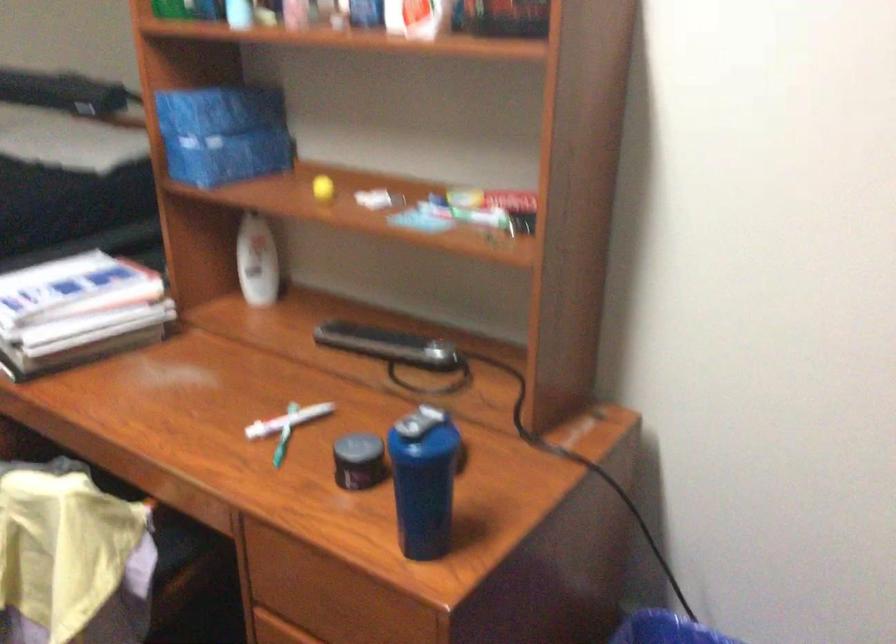
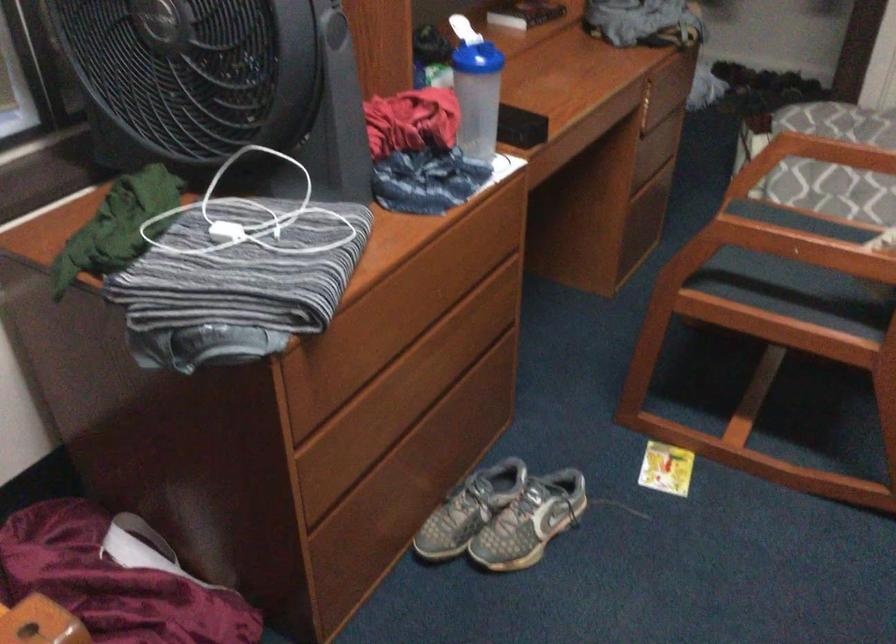
How did the camera likely rotate?

The camera rotated toward left-down.